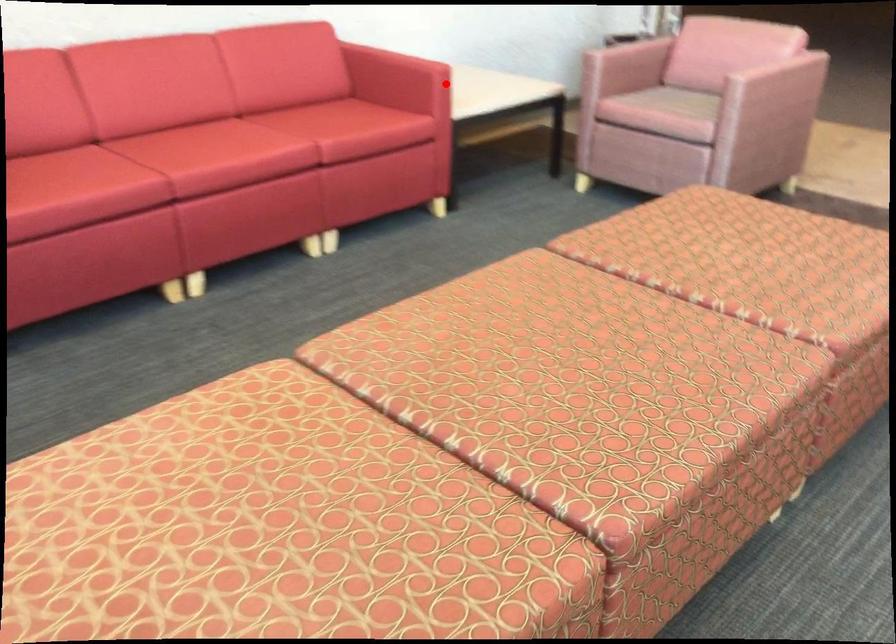
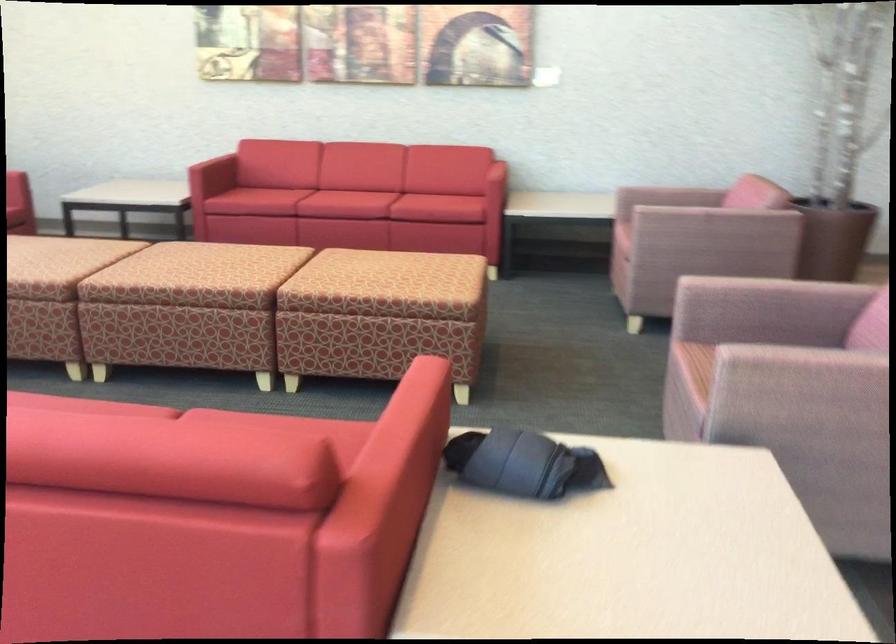
Locate, in the second image, the point that corresponds to the highlighted location in the first image.

(490, 173)